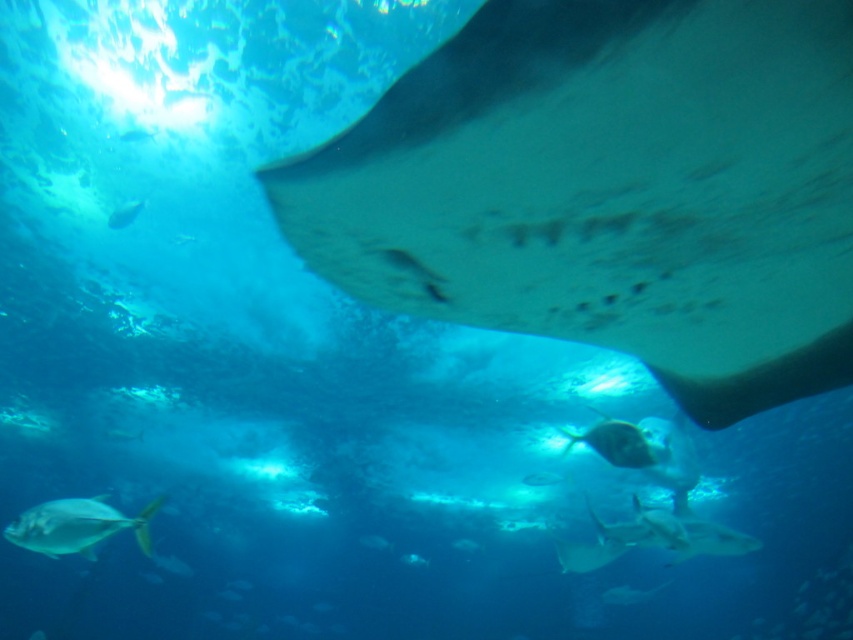
Does shiny silver fish at lower left come behind shiny silver fish at center?

Yes, shiny silver fish at lower left is behind shiny silver fish at center.

The width and height of the screenshot is (853, 640). What do you see at coordinates (76, 525) in the screenshot?
I see `shiny silver fish at lower left` at bounding box center [76, 525].

What are the coordinates of `shiny silver fish at lower left` in the screenshot? It's located at (76, 525).

Is shiny silver fish at center smaller than shiny silver fish at upper left?

Actually, shiny silver fish at center might be larger than shiny silver fish at upper left.

Between shiny silver fish at center and shiny silver fish at upper left, which one is positioned higher?

Positioned higher is shiny silver fish at upper left.

Is point (636, 461) positioned after point (132, 209)?

No, (636, 461) is in front of (132, 209).

Find the location of a particular element. shiny silver fish at center is located at coordinates (619, 444).

Does shiny silver fish at lower left have a lesser width compared to shiny silver fish at upper left?

Incorrect, shiny silver fish at lower left's width is not less than shiny silver fish at upper left's.

Who is more distant from viewer, (73,536) or (115,211)?

The point (115,211) is more distant.

Does point (84, 531) come in front of point (142, 208)?

Yes.

Where is `shiny silver fish at lower left`? The image size is (853, 640). shiny silver fish at lower left is located at coordinates (76, 525).